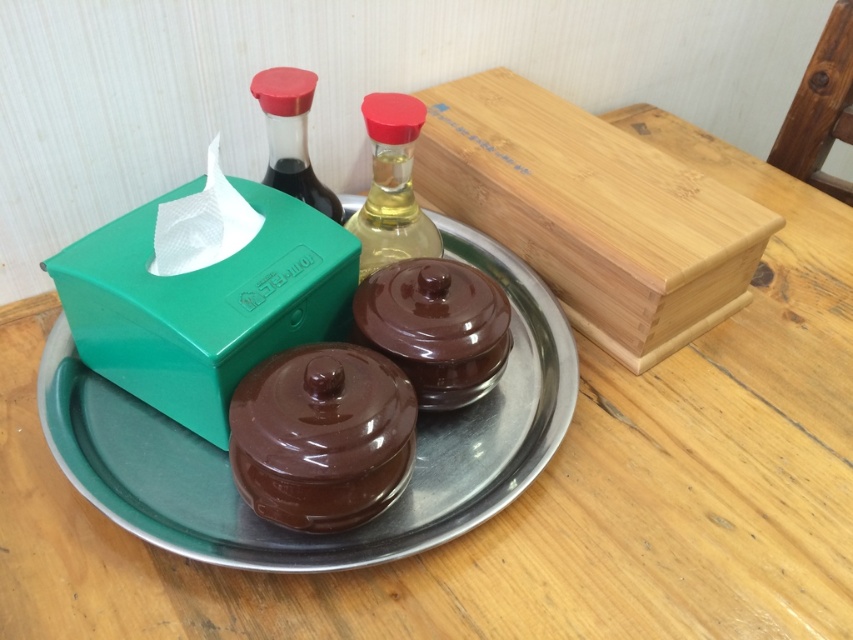
Question: Which point is closer to the camera taking this photo?

Choices:
 (A) (270, 316)
 (B) (386, 113)
 (C) (439, 360)
 (D) (291, 516)

Answer: (D)

Question: Based on their relative distances, which object is nearer to the metallic silver plate at center?

Choices:
 (A) wooden box at upper right
 (B) translucent glass bottle at center
 (C) glossy brown chocolate cake at center

Answer: (C)

Question: From the image, what is the correct spatial relationship of translucent glass bottle at center in relation to matte glass bottle at upper left?

Choices:
 (A) left
 (B) right

Answer: (B)

Question: Can you confirm if wooden box at upper right is positioned to the left of green plastic tissue box at left?

Choices:
 (A) yes
 (B) no

Answer: (B)

Question: Is glossy brown chocolate cake at center in front of matte glass bottle at upper left?

Choices:
 (A) yes
 (B) no

Answer: (A)

Question: Among these points, which one is farthest from the camera?

Choices:
 (A) (241, 556)
 (B) (286, 156)

Answer: (B)